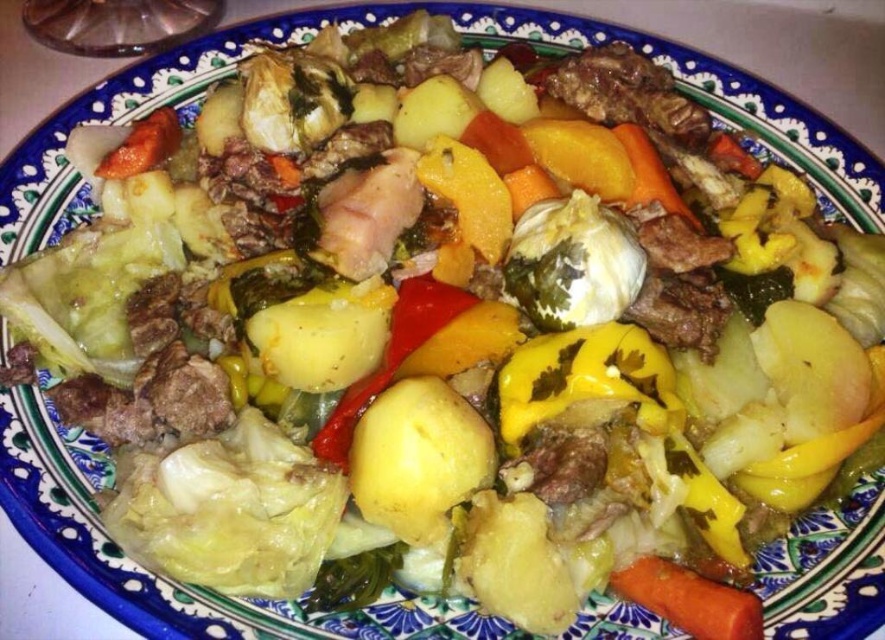
Who is shorter, orange smooth carrot at upper left or orange smooth carrot at center?

With less height is orange smooth carrot at upper left.

Consider the image. Who is higher up, orange smooth carrot at upper left or orange smooth carrot at center?

Positioned higher is orange smooth carrot at upper left.

Is point (140, 120) farther from viewer compared to point (689, 211)?

Yes, it is.

At what (x,y) coordinates should I click in order to perform the action: click on orange smooth carrot at upper left. Please return your answer as a coordinate pair (x, y). This screenshot has width=885, height=640. Looking at the image, I should click on (142, 145).

Which is in front, point (337, 272) or point (626, 144)?

Point (337, 272) is in front.

From the picture: Can you confirm if light brown meat at center is taller than orange smooth carrot at center?

Indeed, light brown meat at center has a greater height compared to orange smooth carrot at center.

In order to click on light brown meat at center in this screenshot , I will do `click(367, 214)`.

The image size is (885, 640). What are the coordinates of `light brown meat at center` in the screenshot? It's located at (367, 214).

Is green leafy cabbage at center thinner than orange smooth carrot at upper left?

No, green leafy cabbage at center is not thinner than orange smooth carrot at upper left.

How much distance is there between green leafy cabbage at center and orange smooth carrot at upper left?

green leafy cabbage at center and orange smooth carrot at upper left are 26.16 inches apart.

What do you see at coordinates (572, 262) in the screenshot? I see `green leafy cabbage at center` at bounding box center [572, 262].

Locate an element on the screen. green leafy cabbage at center is located at coordinates (572, 262).